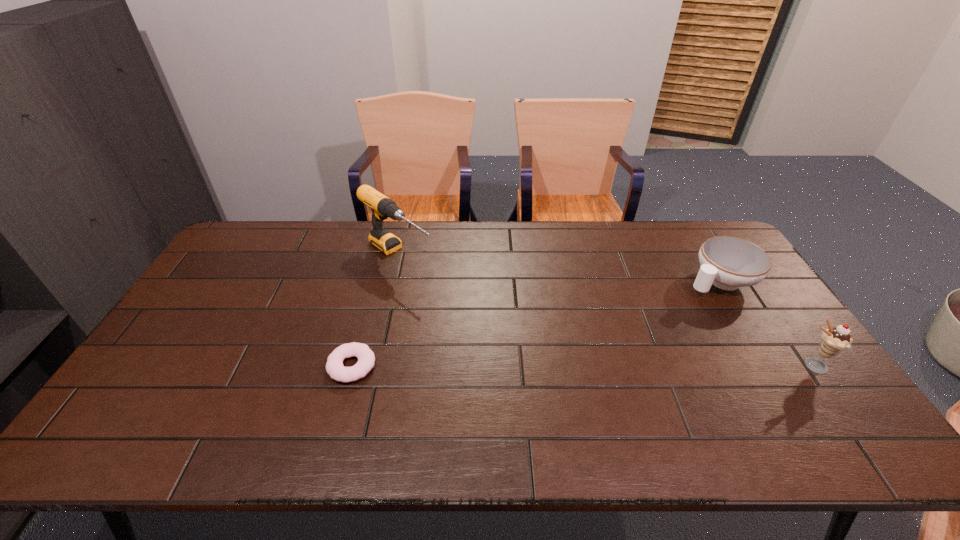
Locate an element on the screen. free point located on the handle side of the tallest object is located at coordinates (481, 315).

Find the location of a particular element. free space located 0.260m on the handle side of the tallest object is located at coordinates (476, 312).

Where is `chinaware that is at the far edge`? The width and height of the screenshot is (960, 540). chinaware that is at the far edge is located at coordinates (728, 263).

You are a GUI agent. You are given a task and a screenshot of the screen. Output one action in this format:
    pyautogui.click(x=<x>, y=<y>)
    Task: Click on the drill located in the far edge section of the desktop
    The height and width of the screenshot is (540, 960).
    Given the screenshot: What is the action you would take?
    pyautogui.click(x=382, y=207)

The width and height of the screenshot is (960, 540). I want to click on object located in the near edge section of the desktop, so click(334, 366).

What are the coordinates of `icecream that is at the right edge` in the screenshot? It's located at (834, 340).

At what (x,y) coordinates should I click in order to perform the action: click on chinaware situated at the right edge. Please return your answer as a coordinate pair (x, y). This screenshot has width=960, height=540. Looking at the image, I should click on (728, 263).

At what (x,y) coordinates should I click in order to perform the action: click on object present at the far right corner. Please return your answer as a coordinate pair (x, y). Image resolution: width=960 pixels, height=540 pixels. Looking at the image, I should click on (728, 263).

You are a GUI agent. You are given a task and a screenshot of the screen. Output one action in this format:
    pyautogui.click(x=<x>, y=<y>)
    Task: Click on the vacant space at the far edge of the desktop
    The height and width of the screenshot is (540, 960).
    Given the screenshot: What is the action you would take?
    pyautogui.click(x=297, y=247)

I want to click on free space at the near edge of the desktop, so click(x=417, y=402).